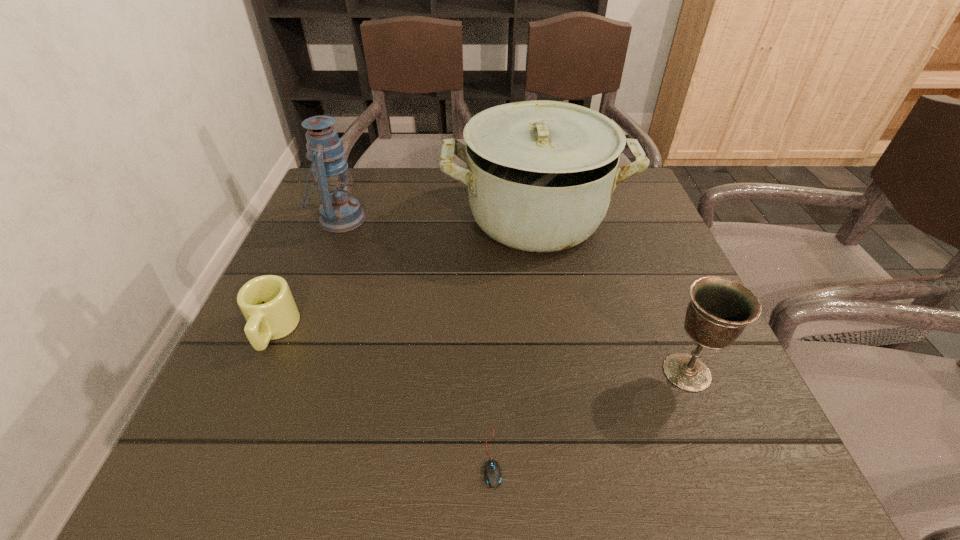
This screenshot has width=960, height=540. What are the coordinates of `vacant space that satisfies the following two spatial constraints: 1. with the handle on the side of the shortest object; 2. on the left side of the mug` in the screenshot? It's located at (217, 457).

The height and width of the screenshot is (540, 960). I want to click on free point that satisfies the following two spatial constraints: 1. on the front-facing side of the lantern; 2. with the handle on the side of the fourth tallest object, so click(x=296, y=330).

The image size is (960, 540). Find the location of `vacant space that satisfies the following two spatial constraints: 1. on the back side of the mouse; 2. on the front-facing side of the lantern`. vacant space that satisfies the following two spatial constraints: 1. on the back side of the mouse; 2. on the front-facing side of the lantern is located at coordinates (488, 219).

Locate an element on the screen. This screenshot has width=960, height=540. blank space that satisfies the following two spatial constraints: 1. on the front-facing side of the lantern; 2. on the back side of the chalice is located at coordinates (279, 372).

Where is `vacant region that satisfies the following two spatial constraints: 1. with the handle on the side of the mug; 2. on the left side of the shortest object`? The height and width of the screenshot is (540, 960). vacant region that satisfies the following two spatial constraints: 1. with the handle on the side of the mug; 2. on the left side of the shortest object is located at coordinates (217, 457).

Where is `free space that satisfies the following two spatial constraints: 1. on the front-facing side of the lantern; 2. with the handle on the side of the fourth tallest object`? The width and height of the screenshot is (960, 540). free space that satisfies the following two spatial constraints: 1. on the front-facing side of the lantern; 2. with the handle on the side of the fourth tallest object is located at coordinates (296, 330).